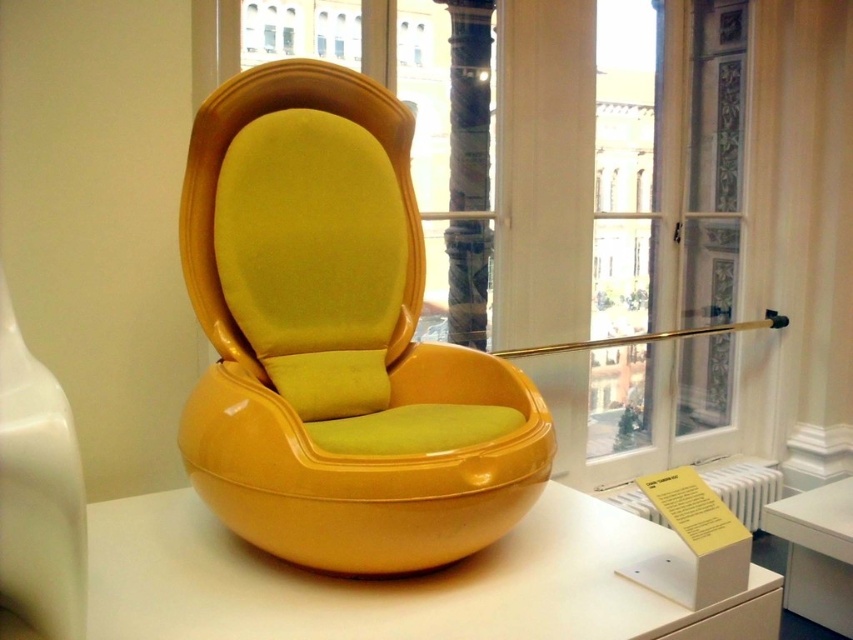
Question: Which of the following is the farthest from the observer?

Choices:
 (A) (129, 608)
 (B) (780, 536)
 (C) (432, 492)

Answer: (B)

Question: Is glossy yellow bowl at center below matte white table at center?

Choices:
 (A) yes
 (B) no

Answer: (B)

Question: Which object appears farthest from the camera in this image?

Choices:
 (A) glossy yellow bowl at center
 (B) matte white table at center

Answer: (B)

Question: Is glossy yellow chair at center closer to camera compared to glossy yellow bowl at center?

Choices:
 (A) no
 (B) yes

Answer: (A)

Question: Is glossy yellow chair at center closer to camera compared to glossy yellow bowl at center?

Choices:
 (A) no
 (B) yes

Answer: (A)

Question: Which object is positioned farthest from the glossy yellow bowl at center?

Choices:
 (A) matte white table at center
 (B) glossy yellow chair at center

Answer: (A)